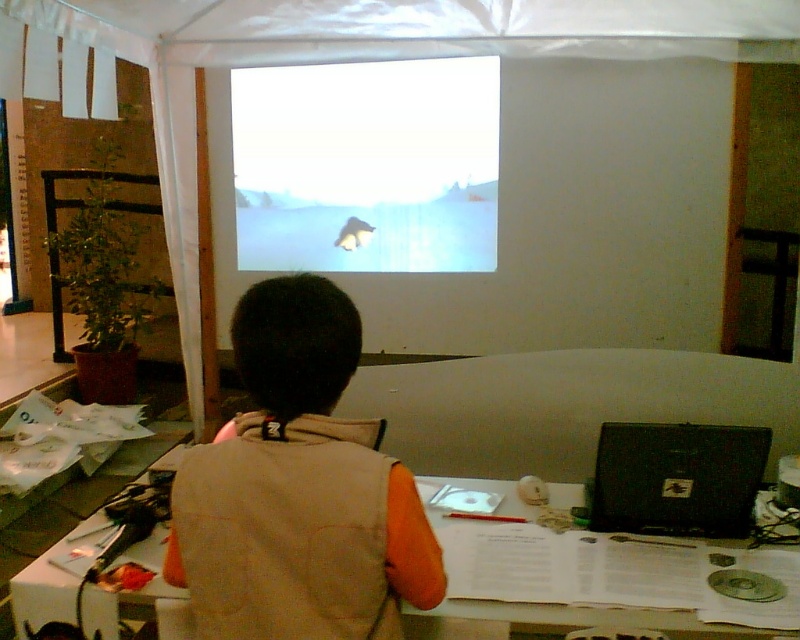
You are an event organizer who needs to ensure that all items on the table are visible to the audience. Given that the orange fabric vest at center and the white paper at center are both on the table, which item might block the view of the other?

The orange fabric vest at center is much taller than the white paper at center, so it might block the view of the white paper at center.